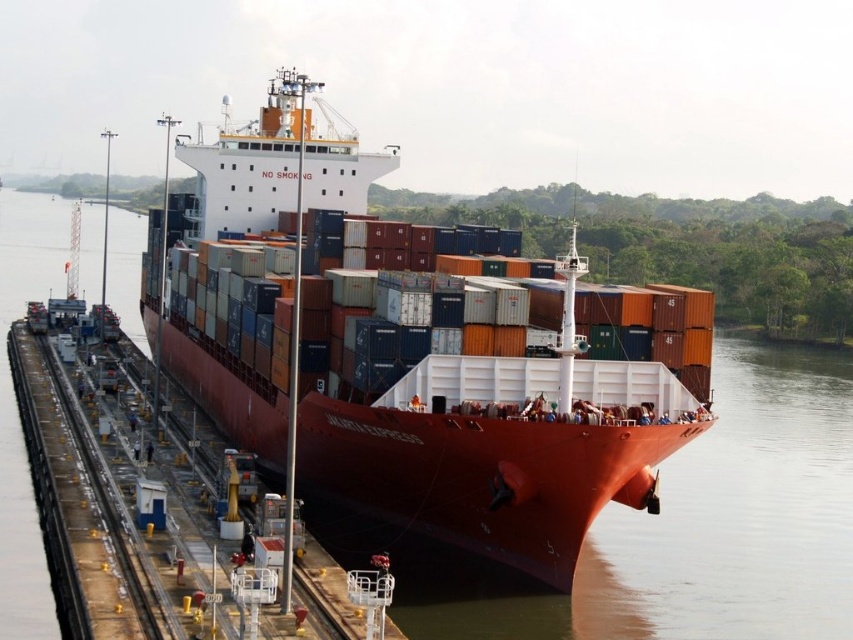
Question: From the image, what is the correct spatial relationship of matte red container ship at center in relation to orange matte container ship at center?

Choices:
 (A) above
 (B) below

Answer: (A)

Question: Which object appears farthest from the camera in this image?

Choices:
 (A) matte red container ship at center
 (B) orange matte container ship at center

Answer: (B)

Question: Among these objects, which one is farthest from the camera?

Choices:
 (A) orange matte container ship at center
 (B) matte red container ship at center

Answer: (A)

Question: Does matte red container ship at center appear on the left side of orange matte container ship at center?

Choices:
 (A) no
 (B) yes

Answer: (A)

Question: Is the position of matte red container ship at center more distant than that of orange matte container ship at center?

Choices:
 (A) no
 (B) yes

Answer: (A)